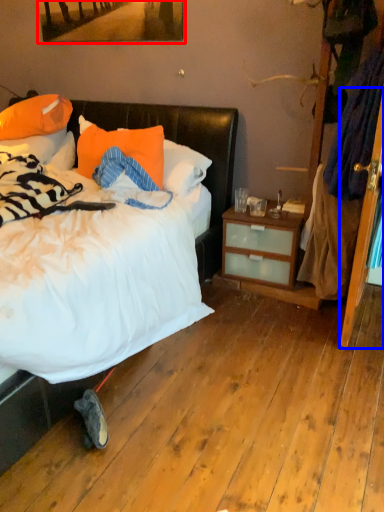
Question: Which object is further to the camera taking this photo, picture frame (highlighted by a red box) or screen door (highlighted by a blue box)?

Choices:
 (A) picture frame
 (B) screen door

Answer: (A)